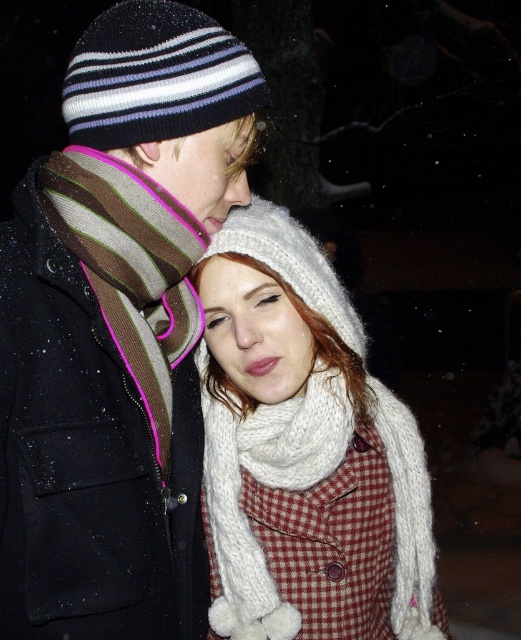
You are a photographer trying to capture the scene of two people in the cold night. You notice the white knitted hat at center and the striped knit scarf at left. Which object is positioned lower in the image?

The white knitted hat at center is located below the striped knit scarf at left, so it is positioned lower in the image.

Based on the coordinates provided, can you identify which object corresponds to the point at (304, 451)?

The point at (304, 451) corresponds to the white knitted hat at center.

You are a photographer trying to capture a closeup of the white knitted hat at center and the striped knit scarf at left. Since you want to focus on the hat, which object should you adjust your camera to prioritize in the foreground?

The white knitted hat at center is closer to the viewer than the striped knit scarf at left, so you should prioritize focusing on the white knitted hat at center to ensure it is in sharp focus in the foreground.